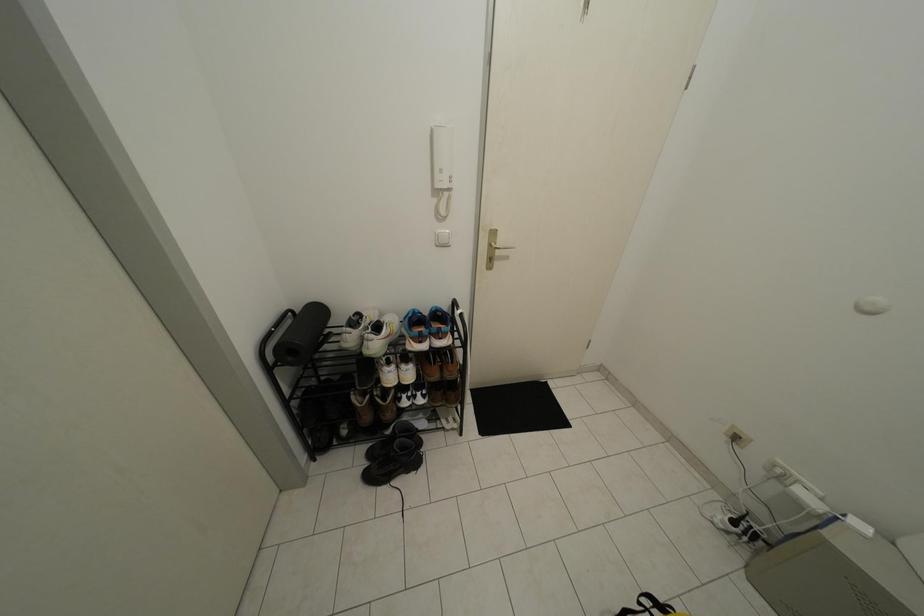
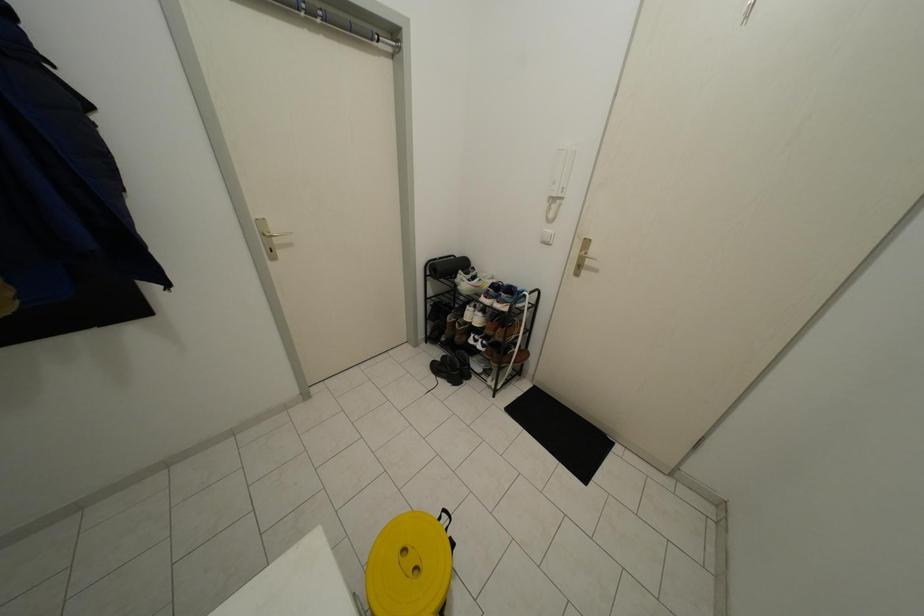
Question: Based on the continuous images, in which direction is the camera rotating? Reply with the corresponding letter.

Choices:
 (A) Left
 (B) Right
 (C) Up
 (D) Down

Answer: (A)